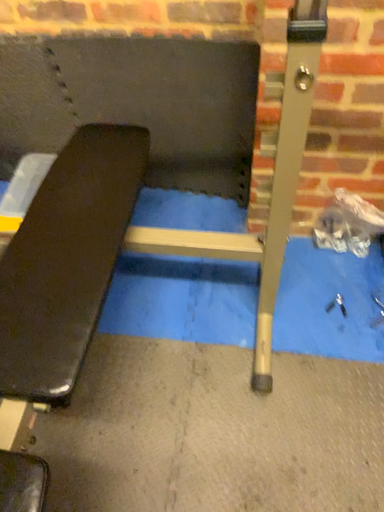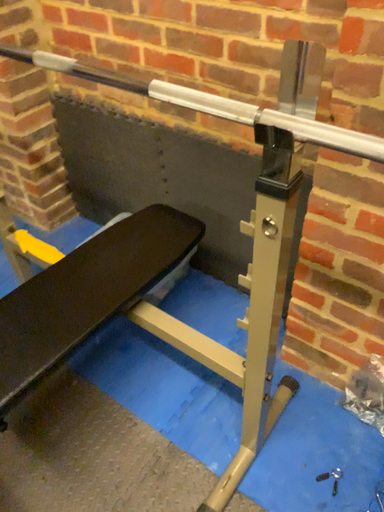
Question: How did the camera likely rotate when shooting the video?

Choices:
 (A) rotated downward
 (B) rotated upward

Answer: (B)